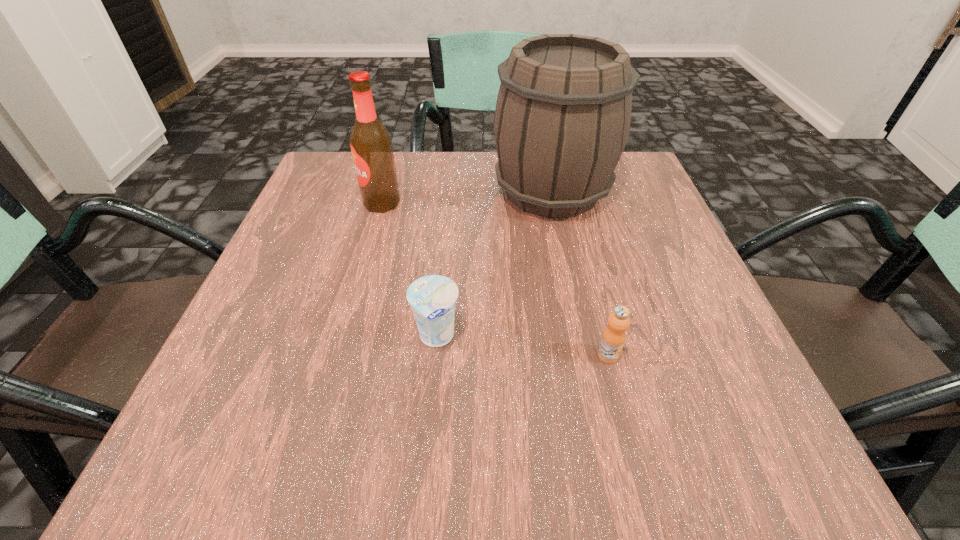
Find the location of a particular element. This screenshot has width=960, height=540. vacant point at the far right corner is located at coordinates (641, 178).

Identify the location of free space at the near right corner of the desktop. (752, 457).

Locate an element on the screen. unoccupied position between the second object from left to right and the leftmost object is located at coordinates (409, 271).

What are the coordinates of `free area in between the wine bucket and the third object from right to left` in the screenshot? It's located at (494, 265).

You are a GUI agent. You are given a task and a screenshot of the screen. Output one action in this format:
    pyautogui.click(x=<x>, y=<y>)
    Task: Click on the blank region between the beer bottle and the wine bucket
    Image resolution: width=960 pixels, height=540 pixels.
    Given the screenshot: What is the action you would take?
    pyautogui.click(x=467, y=197)

Where is `vacant region between the wine bucket and the third object from right to left`? vacant region between the wine bucket and the third object from right to left is located at coordinates (494, 265).

At what (x,y) coordinates should I click in order to perform the action: click on empty space that is in between the wine bucket and the beer bottle. Please return your answer as a coordinate pair (x, y). This screenshot has width=960, height=540. Looking at the image, I should click on (467, 197).

At what (x,y) coordinates should I click in order to perform the action: click on vacant area between the wine bucket and the yogurt. Please return your answer as a coordinate pair (x, y). The width and height of the screenshot is (960, 540). Looking at the image, I should click on (494, 265).

Where is `blank region between the orange juice and the beer bottle`? The height and width of the screenshot is (540, 960). blank region between the orange juice and the beer bottle is located at coordinates (495, 279).

The image size is (960, 540). I want to click on free space between the leftmost object and the wine bucket, so click(x=467, y=197).